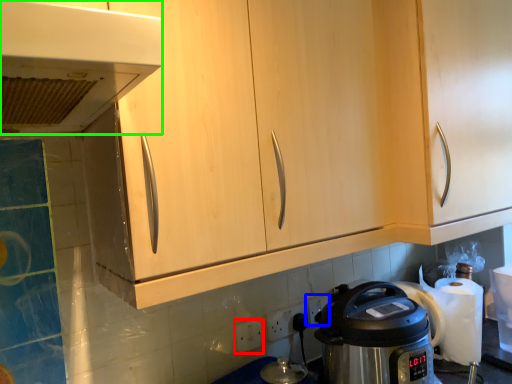
Question: Which is farther away from electric outlet (highlighted by a red box)? electric outlet (highlighted by a blue box) or home appliance (highlighted by a green box)?

Choices:
 (A) electric outlet
 (B) home appliance

Answer: (B)